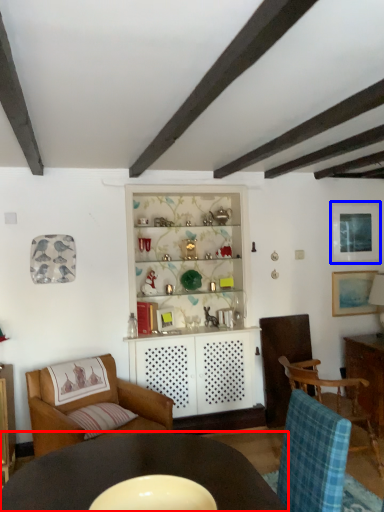
Question: Among these objects, which one is nearest to the camera, table (highlighted by a red box) or picture frame (highlighted by a blue box)?

Choices:
 (A) table
 (B) picture frame

Answer: (A)